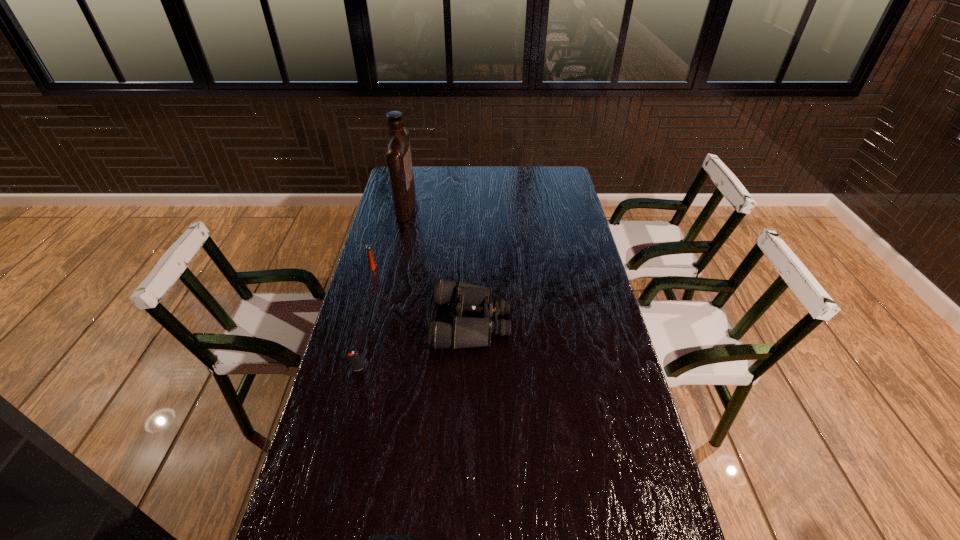
Find the location of a particular element. The width and height of the screenshot is (960, 540). vacant space that's between the taller igniter and the third farthest object is located at coordinates (422, 294).

Identify the location of free space between the tallest object and the second farthest object. (390, 237).

Image resolution: width=960 pixels, height=540 pixels. Identify the location of vacant point located between the second tallest object and the third nearest object. coord(422,294).

Locate an element on the screen. object that is the fourth closest to the third farthest object is located at coordinates (375, 539).

Locate an element on the screen. Image resolution: width=960 pixels, height=540 pixels. object that stands as the closest to the leftmost object is located at coordinates (465, 332).

Image resolution: width=960 pixels, height=540 pixels. Find the location of `vacant point that satisfies the following two spatial constraints: 1. on the front side of the shorter igniter; 2. on the right side of the second farthest object`. vacant point that satisfies the following two spatial constraints: 1. on the front side of the shorter igniter; 2. on the right side of the second farthest object is located at coordinates (345, 369).

You are a GUI agent. You are given a task and a screenshot of the screen. Output one action in this format:
    pyautogui.click(x=<x>, y=<y>)
    Task: Click on the blank space that satisfies the following two spatial constraints: 1. through the eyepieces of the third farthest object; 2. on the front side of the shorter igniter
    
    Given the screenshot: What is the action you would take?
    pyautogui.click(x=470, y=369)